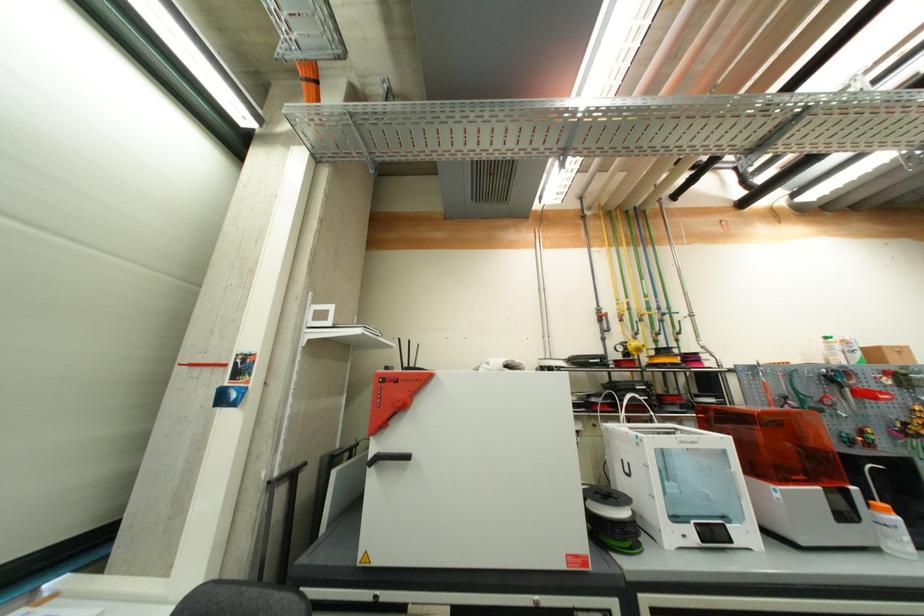
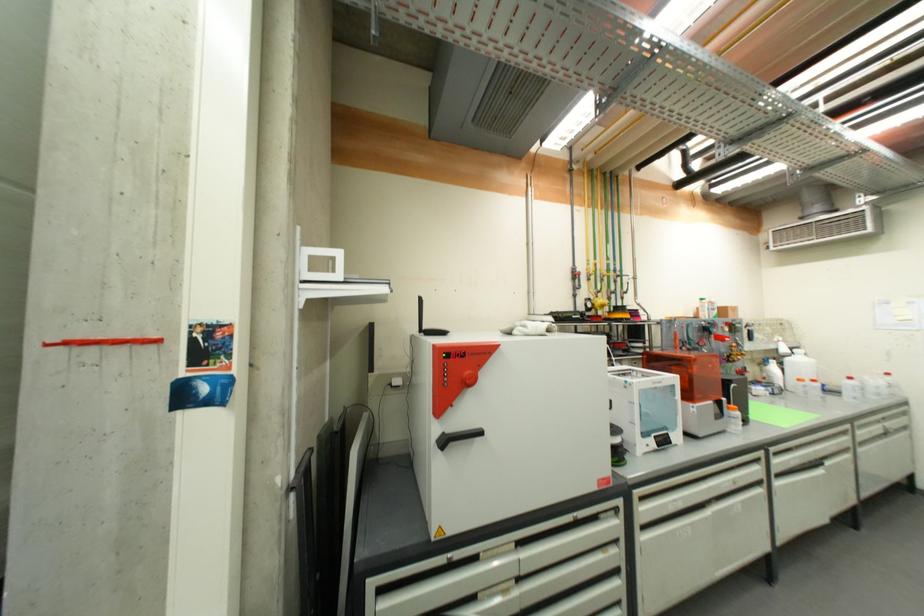
Locate, in the second image, the point that corresponds to point (891, 513) in the first image.

(739, 411)